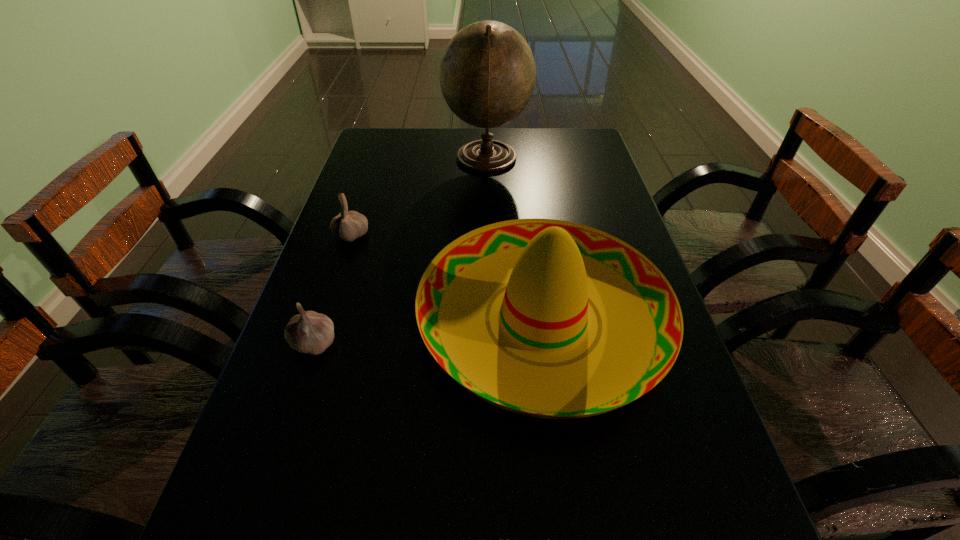
I want to click on free location located 0.370m on the back of the farther garlic, so click(379, 154).

Where is `object positioned at the far edge`? This screenshot has width=960, height=540. object positioned at the far edge is located at coordinates (487, 74).

Where is `object present at the right edge`? The height and width of the screenshot is (540, 960). object present at the right edge is located at coordinates (547, 318).

Find the location of a particular element. vacant point at the far edge is located at coordinates (531, 129).

In order to click on free space at the left edge of the desktop in this screenshot , I will do `click(353, 290)`.

The image size is (960, 540). In the image, there is a desktop. What are the coordinates of `vacant space at the right edge` in the screenshot? It's located at click(607, 169).

Identify the location of free location at the far left corner. The width and height of the screenshot is (960, 540). (392, 152).

Identify the location of vacant space in between the nearer garlic and the farther garlic. 333,289.

This screenshot has width=960, height=540. I want to click on vacant area that lies between the farther garlic and the nearer garlic, so click(333, 289).

Where is `object that is the fourth closest to the farther garlic`? This screenshot has width=960, height=540. object that is the fourth closest to the farther garlic is located at coordinates (548, 539).